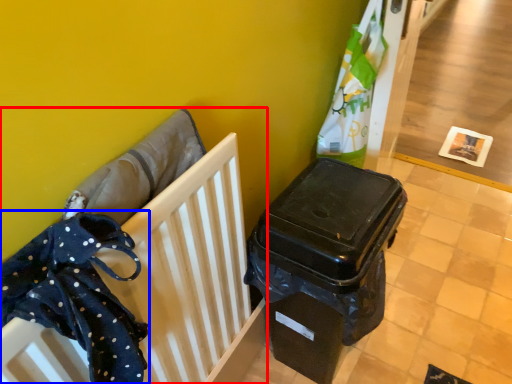
Question: Which object is further to the camera taking this photo, furniture (highlighted by a red box) or clothe (highlighted by a blue box)?

Choices:
 (A) furniture
 (B) clothe

Answer: (A)